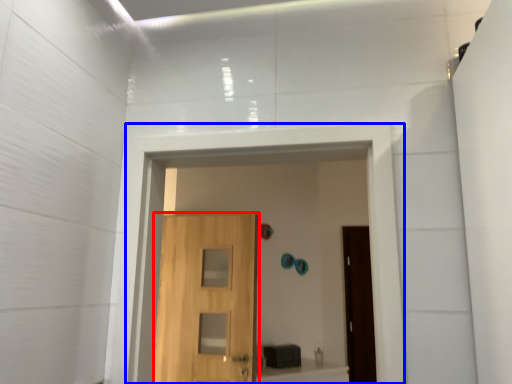
Question: Which point is further to the camera, door (highlighted by a red box) or passage (highlighted by a blue box)?

Choices:
 (A) door
 (B) passage

Answer: (A)